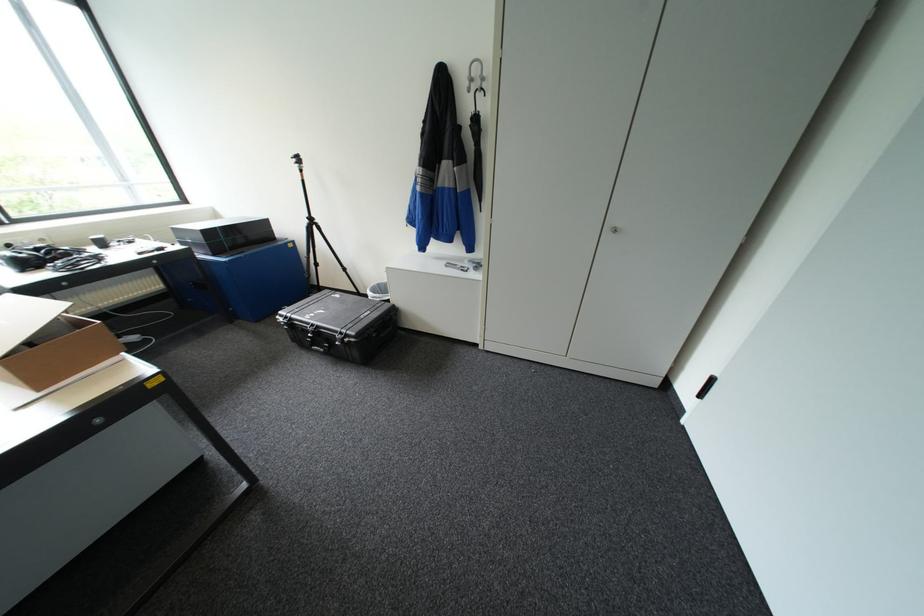
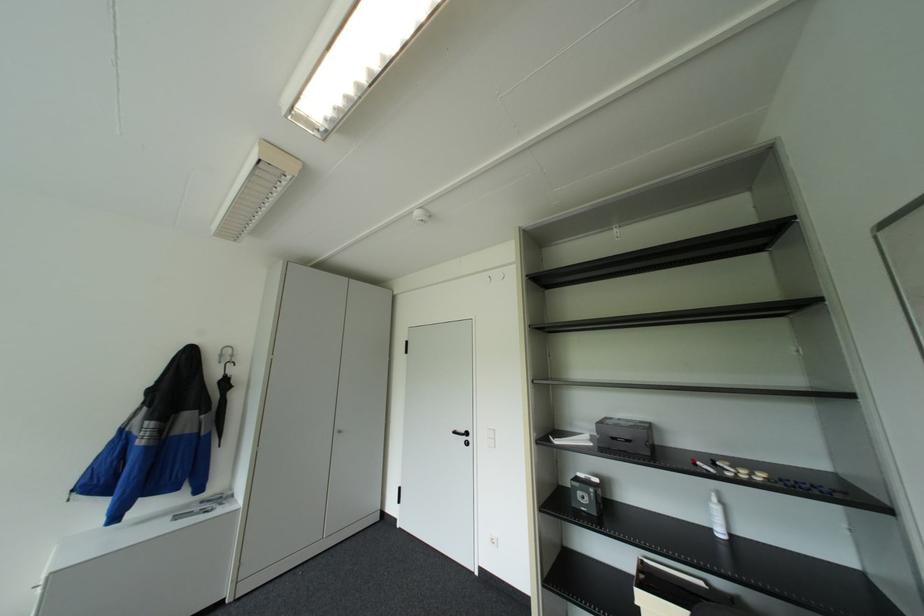
Locate, in the second image, the point that corresponds to point (476, 191) in the first image.

(217, 432)